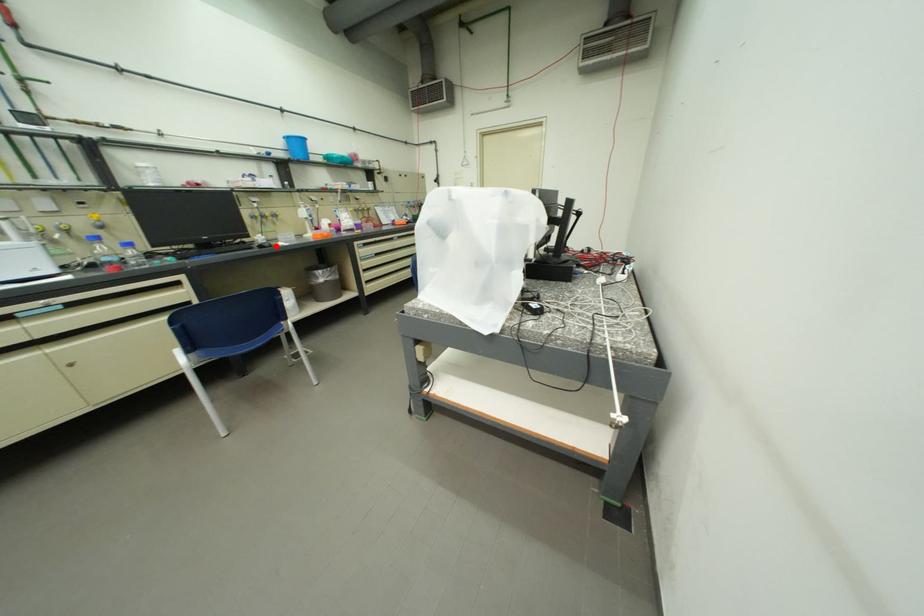
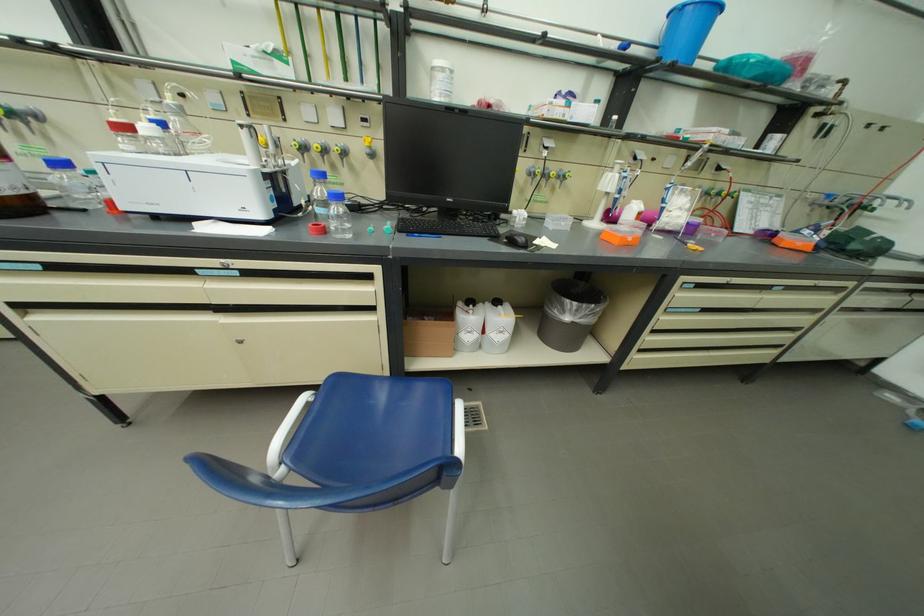
Question: I am providing you with two images of the same scene from different viewpoints. In image1, a red point is highlighted. Considering the same 3D point in image2, which of the following is correct?

Choices:
 (A) It is closer
 (B) It is farther

Answer: (B)